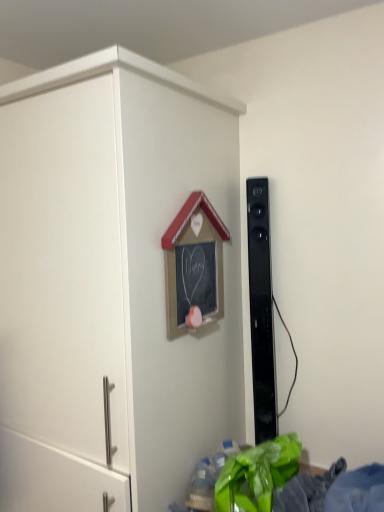
Looking at this image, in order to face black glossy speaker at right, should I rotate leftwards or rightwards?

Rotate right and turn 10.217 degrees.

The image size is (384, 512). Describe the element at coordinates (261, 311) in the screenshot. I see `black glossy speaker at right` at that location.

The width and height of the screenshot is (384, 512). I want to click on black glossy speaker at right, so click(x=261, y=311).

From the picture: Measure the distance between white matte cupboard at center and camera.

They are 37.62 inches apart.

What are the coordinates of `white matte cupboard at center` in the screenshot? It's located at (110, 284).

Describe the element at coordinates (110, 284) in the screenshot. Image resolution: width=384 pixels, height=512 pixels. I see `white matte cupboard at center` at that location.

What is the approximate width of white matte cupboard at center?

white matte cupboard at center is 24.70 inches wide.

At what (x,y) coordinates should I click in order to perform the action: click on black glossy speaker at right. Please return your answer as a coordinate pair (x, y). Looking at the image, I should click on (261, 311).

Which object is positioned more to the left, white matte cupboard at center or black glossy speaker at right?

Positioned to the left is white matte cupboard at center.

Which is behind, white matte cupboard at center or black glossy speaker at right?

black glossy speaker at right is further from the camera.

Is point (144, 65) farther from camera compared to point (261, 290)?

No.

From the image's perspective, who appears lower, white matte cupboard at center or black glossy speaker at right?

white matte cupboard at center, from the image's perspective.

From a real-world perspective, which object rests below the other?

In real-world perspective, white matte cupboard at center is lower.

Between white matte cupboard at center and black glossy speaker at right, which one has smaller width?

Thinner between the two is black glossy speaker at right.

Does white matte cupboard at center have a lesser height compared to black glossy speaker at right?

Incorrect, the height of white matte cupboard at center does not fall short of that of black glossy speaker at right.

Which of these two, white matte cupboard at center or black glossy speaker at right, is smaller?

black glossy speaker at right.

Is black glossy speaker at right completely or partially inside white matte cupboard at center?

No, white matte cupboard at center does not contain black glossy speaker at right.

Is white matte cupboard at center not near black glossy speaker at right?

They are positioned close to each other.

Could you tell me if white matte cupboard at center is facing black glossy speaker at right?

No, white matte cupboard at center is not oriented towards black glossy speaker at right.

How different are the orientations of white matte cupboard at center and black glossy speaker at right in degrees?

white matte cupboard at center and black glossy speaker at right are facing 0.269 degrees away from each other.

Where is `cupboard on the left of black glossy speaker at right`? The height and width of the screenshot is (512, 384). cupboard on the left of black glossy speaker at right is located at coordinates (110, 284).

Between black glossy speaker at right and white matte cupboard at center, which one appears on the right side from the viewer's perspective?

black glossy speaker at right is more to the right.

Is the position of black glossy speaker at right less distant than that of white matte cupboard at center?

No, it is not.

Considering the points (263, 182) and (180, 405), which point is in front, point (263, 182) or point (180, 405)?

Point (180, 405)

From the image's perspective, is black glossy speaker at right positioned above or below white matte cupboard at center?

black glossy speaker at right is above white matte cupboard at center.

From a real-world perspective, who is located lower, black glossy speaker at right or white matte cupboard at center?

From a 3D spatial view, white matte cupboard at center is below.

Does black glossy speaker at right have a lesser width compared to white matte cupboard at center?

Yes, black glossy speaker at right is thinner than white matte cupboard at center.

Based on the photo, considering the sizes of objects black glossy speaker at right and white matte cupboard at center in the image provided, who is shorter, black glossy speaker at right or white matte cupboard at center?

black glossy speaker at right.

Considering the sizes of objects black glossy speaker at right and white matte cupboard at center in the image provided, who is bigger, black glossy speaker at right or white matte cupboard at center?

With larger size is white matte cupboard at center.

Is white matte cupboard at center a part of black glossy speaker at right?

Definitely not — white matte cupboard at center is not inside black glossy speaker at right.

Are black glossy speaker at right and white matte cupboard at center beside each other?

No.

Is black glossy speaker at right turned away from white matte cupboard at center?

No, black glossy speaker at right is not facing away from white matte cupboard at center.

The image size is (384, 512). Identify the location of speaker that is above the white matte cupboard at center (from a real-world perspective). (261, 311).

Identify the location of cupboard lying below the black glossy speaker at right (from the image's perspective). This screenshot has width=384, height=512. (110, 284).

Locate an element on the screen. Image resolution: width=384 pixels, height=512 pixels. speaker above the white matte cupboard at center (from the image's perspective) is located at coordinates click(261, 311).